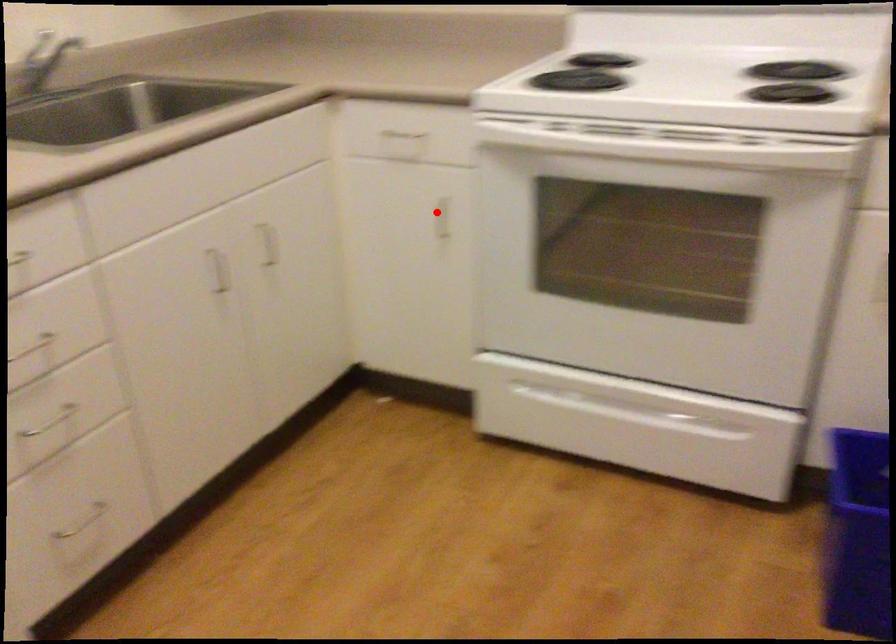
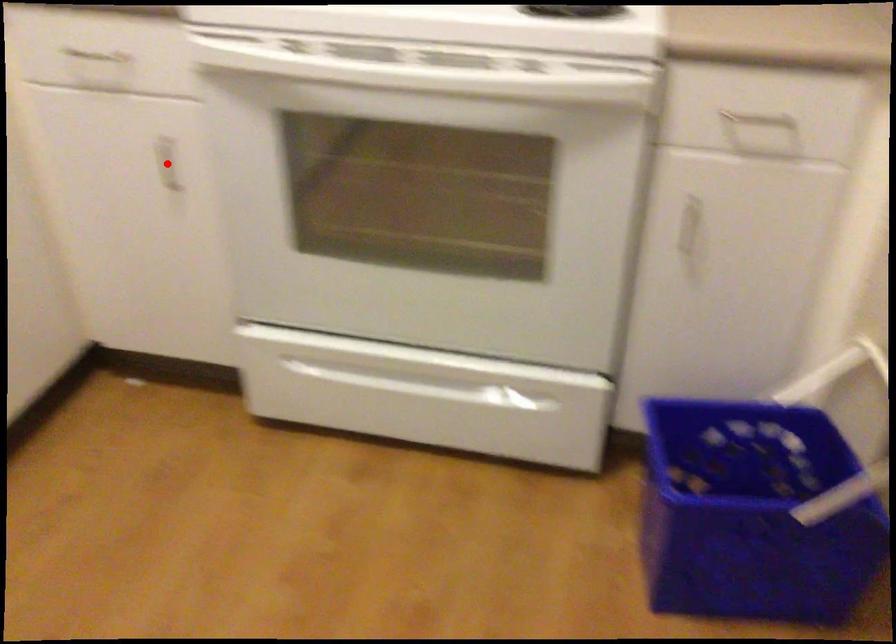
I am providing you with two images of the same scene from different viewpoints. A red point is marked on the first image and another point is marked on the second image. Is the marked point in image1 the same physical position as the marked point in image2?

Yes